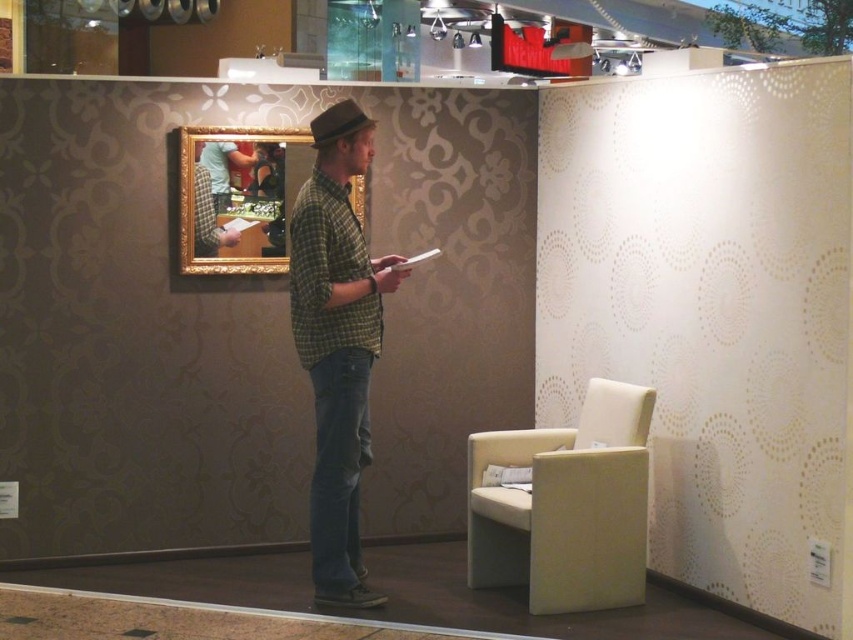
Which is more to the left, beige fabric armchair at lower right or brown felt fedora at center?

brown felt fedora at center is more to the left.

Based on the photo, can you confirm if beige fabric armchair at lower right is shorter than brown felt fedora at center?

No.

Between point (546, 576) and point (346, 134), which one is positioned in front?

Point (346, 134) is in front.

At what (x,y) coordinates should I click in order to perform the action: click on beige fabric armchair at lower right. Please return your answer as a coordinate pair (x, y). Looking at the image, I should click on (566, 506).

Who is positioned more to the right, green plaid shirt at center or brown felt fedora at center?

green plaid shirt at center

Which is above, green plaid shirt at center or brown felt fedora at center?

brown felt fedora at center is above.

Is point (361, 113) more distant than point (358, 129)?

Yes, it is.

Where is `green plaid shirt at center`? Image resolution: width=853 pixels, height=640 pixels. green plaid shirt at center is located at coordinates (337, 342).

From the picture: Can you confirm if beige fabric armchair at lower right is bigger than green plaid shirt at center?

Correct, beige fabric armchair at lower right is larger in size than green plaid shirt at center.

Can you confirm if beige fabric armchair at lower right is positioned above green plaid shirt at center?

Incorrect, beige fabric armchair at lower right is not positioned above green plaid shirt at center.

Is point (641, 541) less distant than point (329, 529)?

No, (641, 541) is behind (329, 529).

This screenshot has height=640, width=853. In order to click on beige fabric armchair at lower right in this screenshot , I will do `click(566, 506)`.